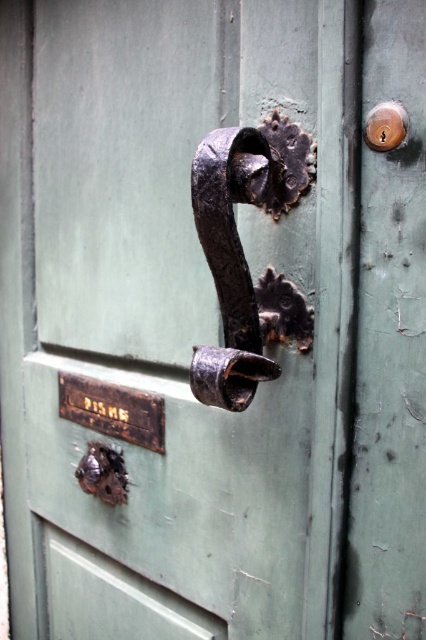
Does point (115, 467) come behind point (386, 125)?

Yes.

Where is `rusty metal latch at lower left`? The image size is (426, 640). rusty metal latch at lower left is located at coordinates (103, 474).

Which is in front, point (244, 278) or point (101, 499)?

Point (244, 278)

Does rusty metal door handle at center have a greater height compared to rusty metal latch at lower left?

Correct, rusty metal door handle at center is much taller as rusty metal latch at lower left.

Is point (259, 308) farther from camera compared to point (92, 484)?

No, (259, 308) is in front of (92, 484).

In order to click on rusty metal door handle at center in this screenshot , I will do (x=244, y=253).

Does rusty metal door handle at center appear over polished brass keyhole at upper right?

Actually, rusty metal door handle at center is below polished brass keyhole at upper right.

Which is below, rusty metal door handle at center or polished brass keyhole at upper right?

Positioned lower is rusty metal door handle at center.

Where is `rusty metal door handle at center`? rusty metal door handle at center is located at coordinates (244, 253).

Find the location of a particular element. The image size is (426, 640). rusty metal door handle at center is located at coordinates (244, 253).